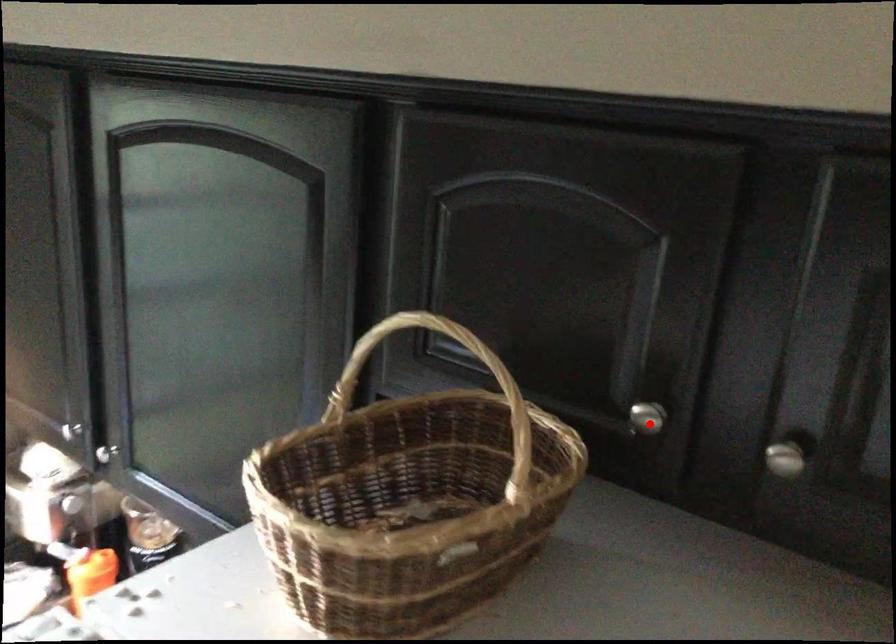
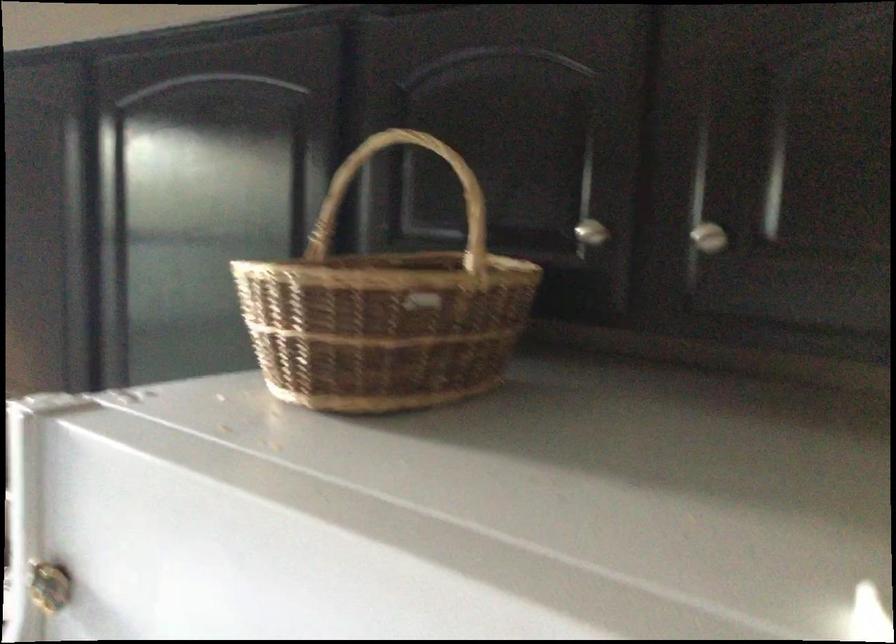
Question: I am providing you with two images of the same scene from different viewpoints. In image1, a red point is highlighted. Considering the same 3D point in image2, which of the following is correct?

Choices:
 (A) It is closer
 (B) It is farther

Answer: (B)